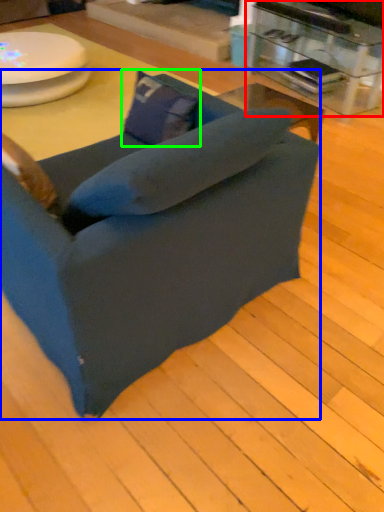
Question: Considering the real-world distances, which object is farthest from table (highlighted by a red box)? chair (highlighted by a blue box) or pillow (highlighted by a green box)?

Choices:
 (A) chair
 (B) pillow

Answer: (A)